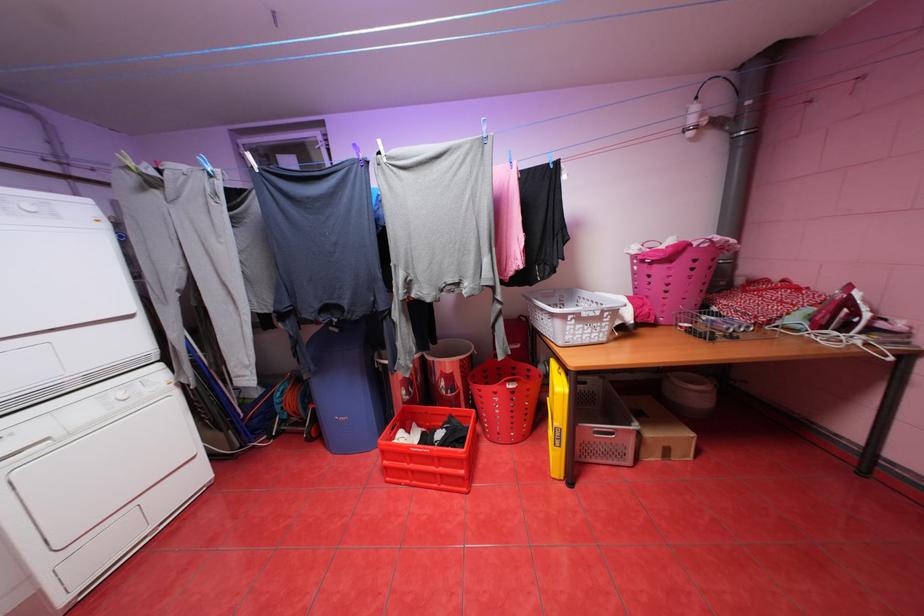
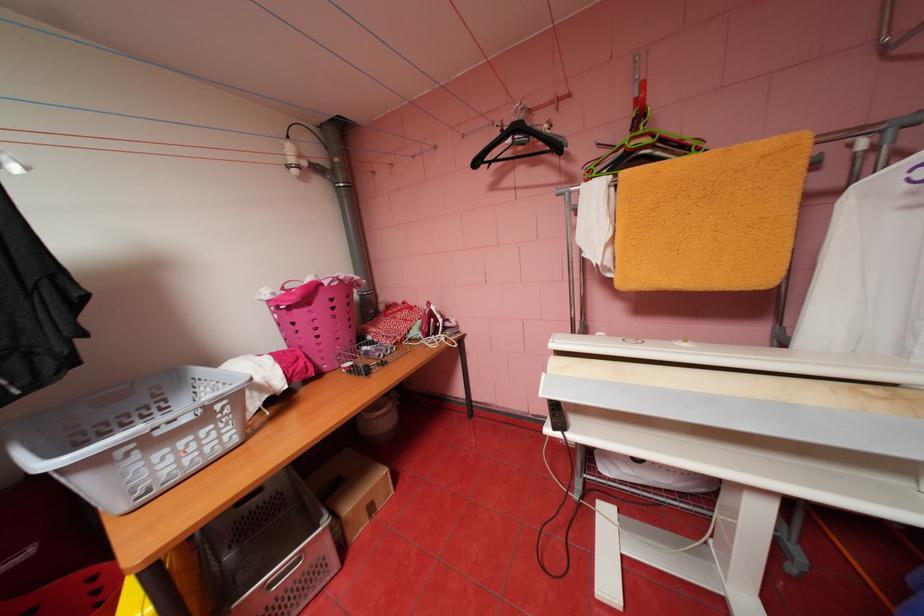
Where in the second image is the point corresponding to point (664, 265) from the first image?

(304, 310)